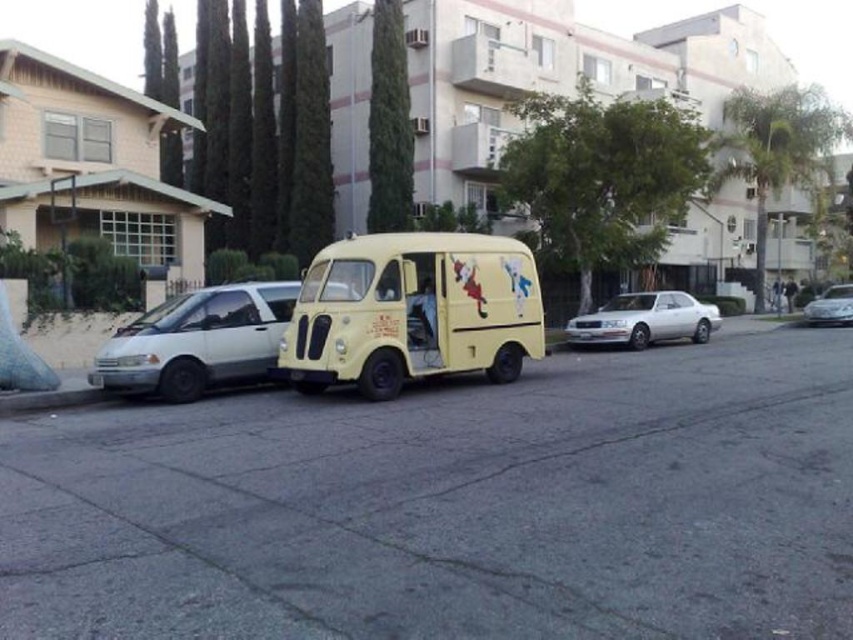
Consider the image. You are standing on the street looking at the yellow van. There are two points marked on the van, one at coordinates point (637,332) and another at point (837,296). Which point is closer to you?

Point (637,332) is closer to the viewer than point (837,296).